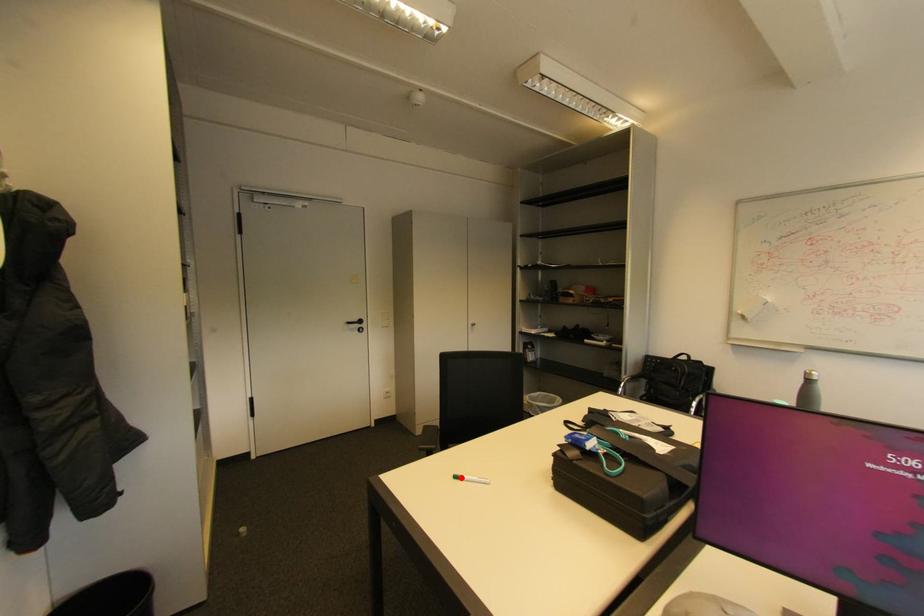
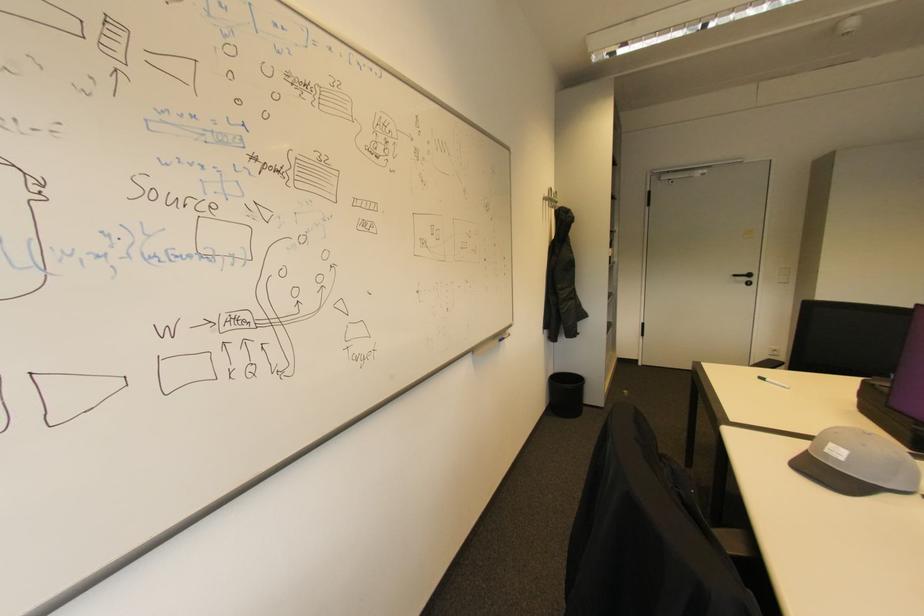
Question: I am providing you with two images of the same scene from different viewpoints. Image1 has a red point marked. In image2, the corresponding 3D location appears at what relative position? Reply with the corresponding letter.

Choices:
 (A) Closer
 (B) Farther

Answer: (B)